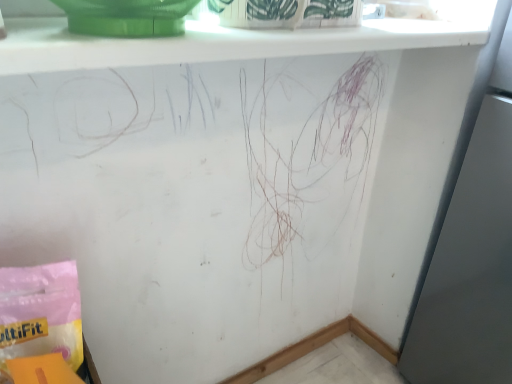
Question: Does white glossy window sill at upper center contain pink paper bag at lower left?

Choices:
 (A) no
 (B) yes

Answer: (A)

Question: From a real-world perspective, is white glossy window sill at upper center located higher than pink paper bag at lower left?

Choices:
 (A) no
 (B) yes

Answer: (B)

Question: Are white glossy window sill at upper center and pink paper bag at lower left making contact?

Choices:
 (A) yes
 (B) no

Answer: (B)

Question: Is white glossy window sill at upper center turned away from pink paper bag at lower left?

Choices:
 (A) no
 (B) yes

Answer: (A)

Question: Is white glossy window sill at upper center bigger than pink paper bag at lower left?

Choices:
 (A) yes
 (B) no

Answer: (A)

Question: Can you confirm if white glossy window sill at upper center is shorter than pink paper bag at lower left?

Choices:
 (A) yes
 (B) no

Answer: (A)

Question: Is white glossy window sill at upper center at the back of pink paper bag at lower left?

Choices:
 (A) yes
 (B) no

Answer: (B)

Question: Considering the relative sizes of pink paper bag at lower left and white glossy window sill at upper center in the image provided, is pink paper bag at lower left smaller than white glossy window sill at upper center?

Choices:
 (A) no
 (B) yes

Answer: (B)

Question: Is pink paper bag at lower left positioned beyond the bounds of white glossy window sill at upper center?

Choices:
 (A) yes
 (B) no

Answer: (A)

Question: Can you confirm if pink paper bag at lower left is positioned to the right of white glossy window sill at upper center?

Choices:
 (A) yes
 (B) no

Answer: (B)

Question: Is the surface of pink paper bag at lower left in direct contact with white glossy window sill at upper center?

Choices:
 (A) yes
 (B) no

Answer: (B)

Question: Does pink paper bag at lower left have a lesser width compared to white glossy window sill at upper center?

Choices:
 (A) no
 (B) yes

Answer: (B)

Question: Is point (12, 274) closer or farther from the camera than point (391, 19)?

Choices:
 (A) closer
 (B) farther

Answer: (A)